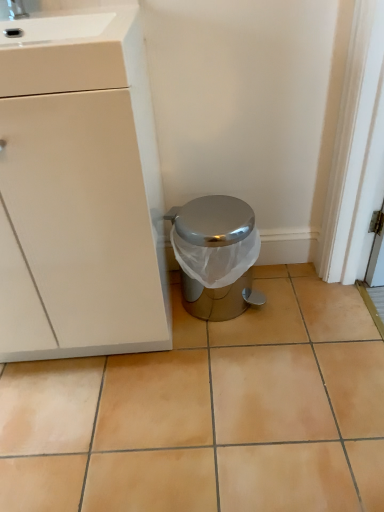
Question: From a real-world perspective, is shiny metallic trash can at center on top of white matte cabinet at left?

Choices:
 (A) yes
 (B) no

Answer: (B)

Question: Is shiny metallic trash can at center located outside white matte cabinet at left?

Choices:
 (A) yes
 (B) no

Answer: (A)

Question: From the image's perspective, is shiny metallic trash can at center located above white matte cabinet at left?

Choices:
 (A) no
 (B) yes

Answer: (A)

Question: Is shiny metallic trash can at center aimed at white matte cabinet at left?

Choices:
 (A) yes
 (B) no

Answer: (B)

Question: Considering the relative sizes of shiny metallic trash can at center and white matte cabinet at left in the image provided, is shiny metallic trash can at center bigger than white matte cabinet at left?

Choices:
 (A) yes
 (B) no

Answer: (B)

Question: Is white matte cabinet at left taller or shorter than shiny metallic trash can at center?

Choices:
 (A) short
 (B) tall

Answer: (B)

Question: From the image's perspective, is white matte cabinet at left positioned above or below shiny metallic trash can at center?

Choices:
 (A) below
 (B) above

Answer: (B)

Question: In terms of size, does white matte cabinet at left appear bigger or smaller than shiny metallic trash can at center?

Choices:
 (A) big
 (B) small

Answer: (A)

Question: Is white matte cabinet at left situated inside shiny metallic trash can at center or outside?

Choices:
 (A) outside
 (B) inside

Answer: (A)

Question: From a real-world perspective, relative to shiny metallic trash can at center, is beige ceramic tile at center vertically above or below?

Choices:
 (A) above
 (B) below

Answer: (B)

Question: Is beige ceramic tile at center situated inside shiny metallic trash can at center or outside?

Choices:
 (A) outside
 (B) inside

Answer: (A)

Question: Considering the positions of beige ceramic tile at center and shiny metallic trash can at center in the image, is beige ceramic tile at center wider or thinner than shiny metallic trash can at center?

Choices:
 (A) thin
 (B) wide

Answer: (B)

Question: From the image's perspective, is beige ceramic tile at center positioned above or below shiny metallic trash can at center?

Choices:
 (A) above
 (B) below

Answer: (B)

Question: Considering their positions, is beige ceramic tile at center located in front of or behind white matte cabinet at left?

Choices:
 (A) behind
 (B) front

Answer: (A)

Question: Looking at their shapes, would you say beige ceramic tile at center is wider or thinner than white matte cabinet at left?

Choices:
 (A) wide
 (B) thin

Answer: (A)